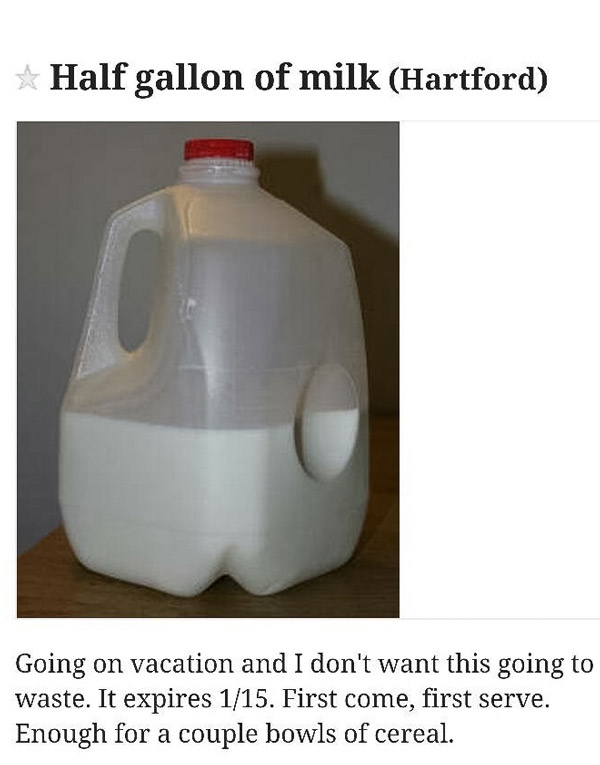
The image size is (600, 765). Find the location of `1 white wall`. 1 white wall is located at coordinates (38, 295).